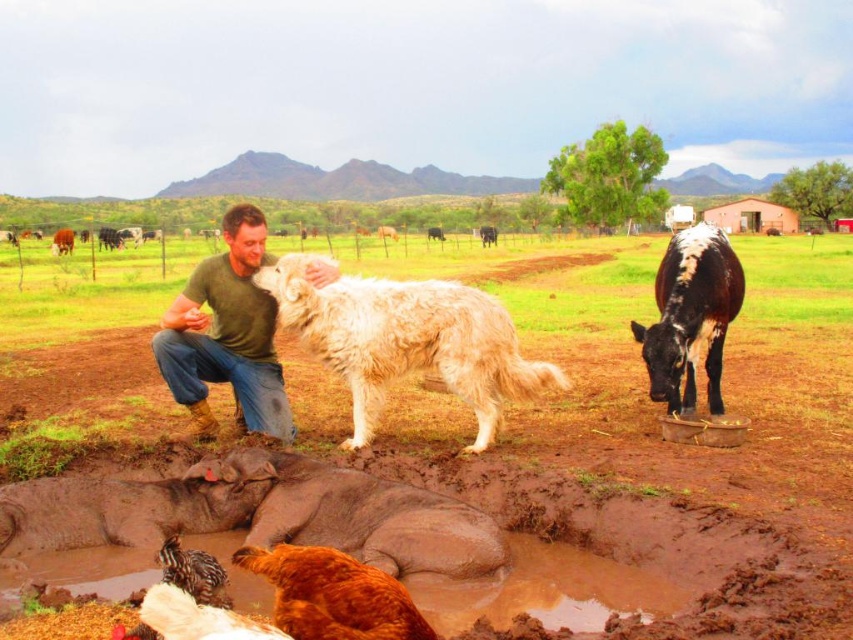
Does brown soil at center have a lesser width compared to golden brown feathers at lower center?

No.

From the picture: Is brown soil at center below golden brown feathers at lower center?

No, brown soil at center is not below golden brown feathers at lower center.

The width and height of the screenshot is (853, 640). Describe the element at coordinates (646, 380) in the screenshot. I see `brown soil at center` at that location.

At what (x,y) coordinates should I click in order to perform the action: click on brown soil at center. Please return your answer as a coordinate pair (x, y). Image resolution: width=853 pixels, height=640 pixels. Looking at the image, I should click on (646, 380).

Can you confirm if brown fuzzy dog at lower center is positioned to the right of golden brown feathers at lower center?

No, brown fuzzy dog at lower center is not to the right of golden brown feathers at lower center.

Is brown fuzzy dog at lower center further to camera compared to golden brown feathers at lower center?

Yes, brown fuzzy dog at lower center is further from the viewer.

Does point (229, 480) come farther from viewer compared to point (340, 600)?

Yes.

Locate an element on the screen. The height and width of the screenshot is (640, 853). brown fuzzy dog at lower center is located at coordinates (357, 513).

Does point (444, 376) come behind point (263, 225)?

No, (444, 376) is closer to viewer.

Is point (297, 296) farther from viewer compared to point (234, 275)?

No.

Identify the location of white fluffy dog at center. This screenshot has width=853, height=640. (407, 340).